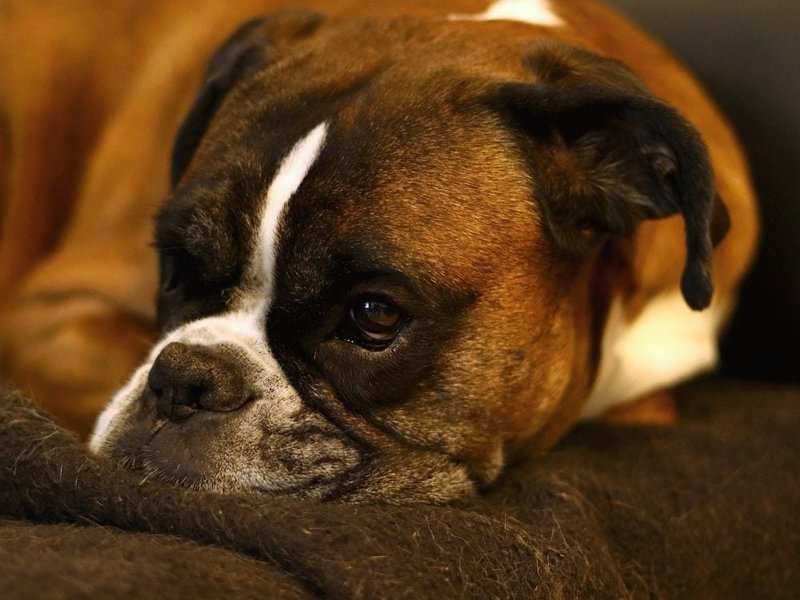
The image size is (800, 600). What are the coordinates of `brown blanket` in the screenshot? It's located at (274, 540).